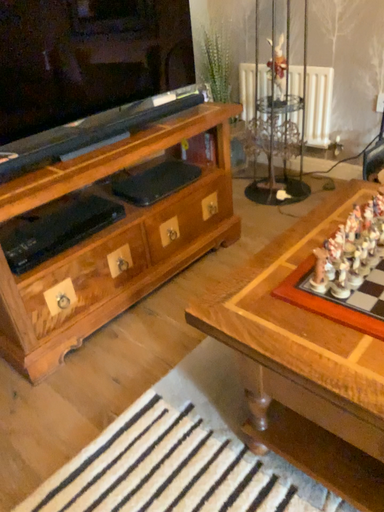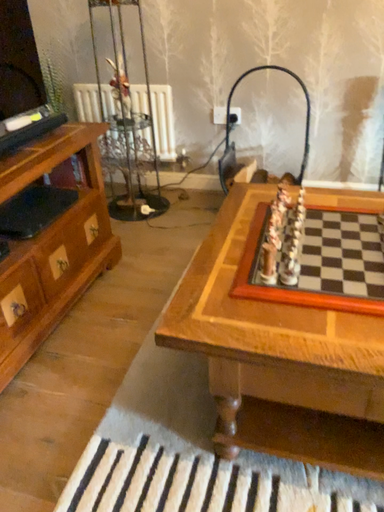
Question: Which way did the camera rotate in the video?

Choices:
 (A) rotated left
 (B) rotated right

Answer: (B)